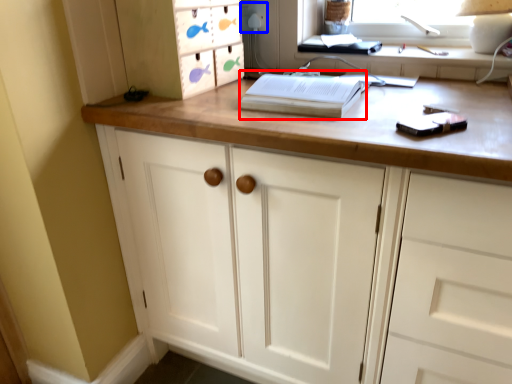
Question: Among these objects, which one is nearest to the camera, paperback book (highlighted by a red box) or electric outlet (highlighted by a blue box)?

Choices:
 (A) paperback book
 (B) electric outlet

Answer: (A)